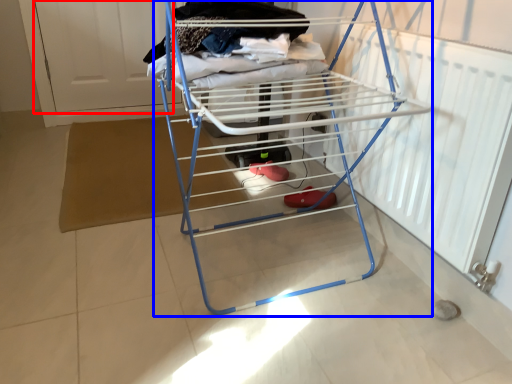
Question: Which object is closer to the camera taking this photo, screen door (highlighted by a red box) or furniture (highlighted by a blue box)?

Choices:
 (A) screen door
 (B) furniture

Answer: (B)